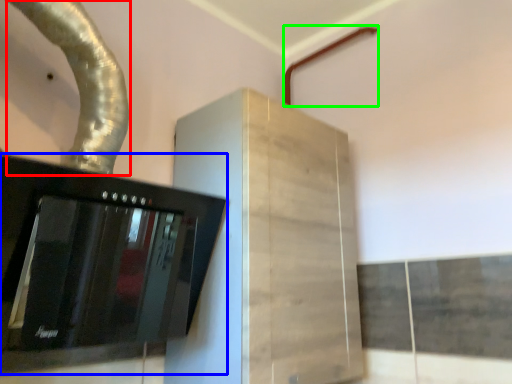
Question: Which is nearer to the water pipe (highlighted by a red box)? home appliance (highlighted by a blue box) or pipe (highlighted by a green box).

Choices:
 (A) home appliance
 (B) pipe

Answer: (A)